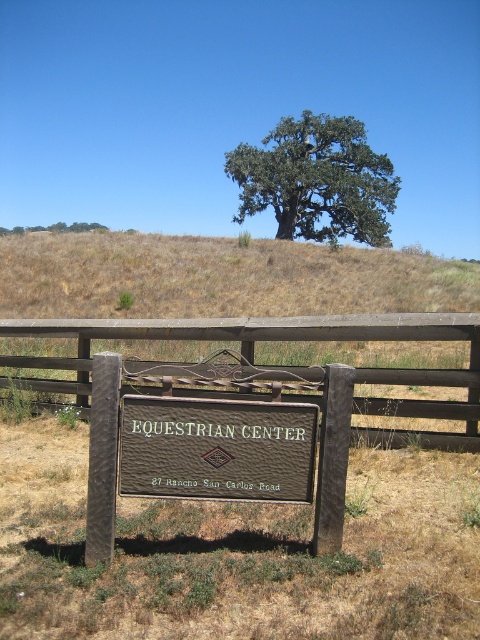
Question: Which object is the farthest from the green leafy tree at upper center?

Choices:
 (A) brown leather sign at center
 (B) brown wooden fence at center

Answer: (B)

Question: Is brown leather sign at center in front of green leafy tree at upper center?

Choices:
 (A) no
 (B) yes

Answer: (B)

Question: Among these points, which one is farthest from the camera?

Choices:
 (A) (227, 481)
 (B) (364, 374)
 (C) (256, 180)

Answer: (C)

Question: Which object is closer to the camera taking this photo?

Choices:
 (A) green leafy tree at upper center
 (B) brown leather sign at center

Answer: (B)

Question: Is brown wooden fence at center to the right of green leafy tree at upper center from the viewer's perspective?

Choices:
 (A) yes
 (B) no

Answer: (B)

Question: Considering the relative positions of brown leather sign at center and green leafy tree at upper center in the image provided, where is brown leather sign at center located with respect to green leafy tree at upper center?

Choices:
 (A) below
 (B) above

Answer: (A)